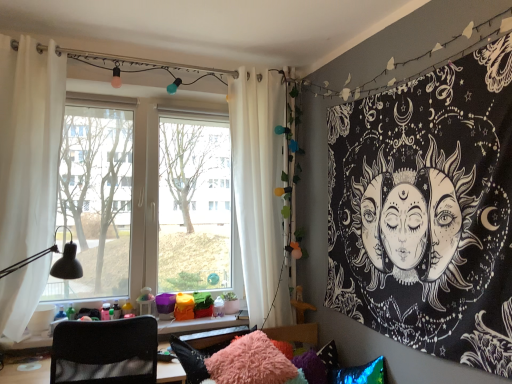
Question: Is black mesh chair at lower left positioned far away from white fabric curtain at right, arranged as the 2th curtain when viewed from the left?

Choices:
 (A) no
 (B) yes

Answer: (B)

Question: From the image's perspective, is black mesh chair at lower left on top of white fabric curtain at right, the 1th curtain from the back?

Choices:
 (A) no
 (B) yes

Answer: (A)

Question: From the image's perspective, is black mesh chair at lower left beneath white fabric curtain at right, the 1th curtain viewed from the right?

Choices:
 (A) no
 (B) yes

Answer: (B)

Question: Considering the relative sizes of black mesh chair at lower left and white fabric curtain at right, the 1th curtain from the back, in the image provided, is black mesh chair at lower left taller than white fabric curtain at right, the 1th curtain from the back,?

Choices:
 (A) yes
 (B) no

Answer: (B)

Question: Considering the relative sizes of black mesh chair at lower left and white fabric curtain at right, the 1th curtain from the back, in the image provided, is black mesh chair at lower left wider than white fabric curtain at right, the 1th curtain from the back,?

Choices:
 (A) yes
 (B) no

Answer: (A)

Question: Are black mesh chair at lower left and white fabric curtain at right, which appears as the second curtain when viewed from the front, making contact?

Choices:
 (A) yes
 (B) no

Answer: (B)

Question: Is white sheer curtain at left, which is counted as the first curtain, starting from the left, smaller than white fabric curtain at right, which appears as the second curtain when viewed from the front?

Choices:
 (A) no
 (B) yes

Answer: (B)

Question: Is white fabric curtain at right, the 1th curtain viewed from the right, located within white sheer curtain at left, the first curtain from the front?

Choices:
 (A) no
 (B) yes

Answer: (A)

Question: Is white sheer curtain at left, which is counted as the second curtain, starting from the right, positioned beyond the bounds of white fabric curtain at right, arranged as the 2th curtain when viewed from the left?

Choices:
 (A) yes
 (B) no

Answer: (A)

Question: From the image's perspective, would you say white sheer curtain at left, the first curtain from the front, is positioned over white fabric curtain at right, arranged as the 2th curtain when viewed from the left?

Choices:
 (A) yes
 (B) no

Answer: (A)

Question: Is white sheer curtain at left, the first curtain from the front, at the left side of white fabric curtain at right, the 1th curtain viewed from the right?

Choices:
 (A) no
 (B) yes

Answer: (B)

Question: Is white sheer curtain at left, the first curtain from the front, oriented away from white fabric curtain at right, the 1th curtain viewed from the right?

Choices:
 (A) no
 (B) yes

Answer: (A)

Question: From a real-world perspective, is black mesh chair at lower left on black paper tapestry at upper right?

Choices:
 (A) yes
 (B) no

Answer: (B)